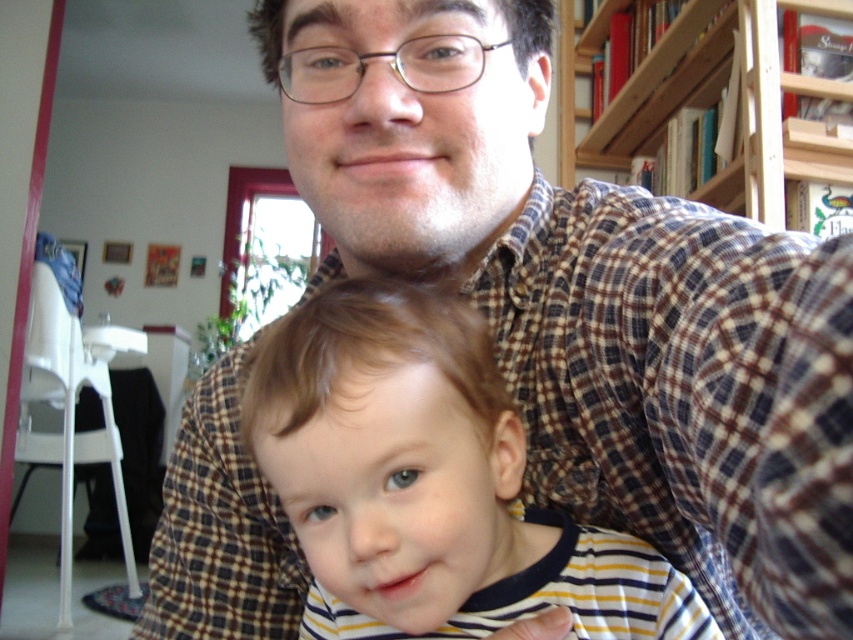
Question: Is striped cotton shirt at center below wooden bookshelf at upper right?

Choices:
 (A) yes
 (B) no

Answer: (A)

Question: Which point is farther to the camera?

Choices:
 (A) (776, 196)
 (B) (415, 378)

Answer: (A)

Question: Which point appears closest to the camera in this image?

Choices:
 (A) (723, 65)
 (B) (469, 324)

Answer: (B)

Question: Where is striped cotton shirt at center located in relation to wooden bookshelf at upper right in the image?

Choices:
 (A) right
 (B) left

Answer: (B)

Question: In this image, where is striped cotton shirt at center located relative to wooden bookshelf at upper right?

Choices:
 (A) above
 (B) below

Answer: (B)